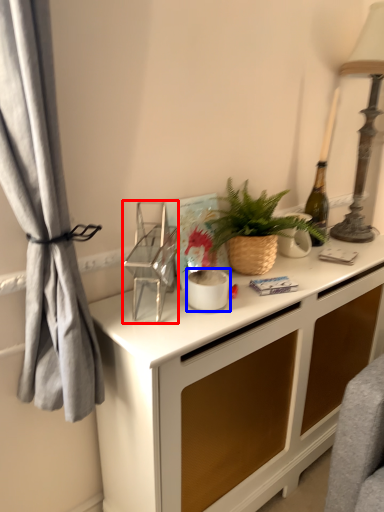
Question: Among these objects, which one is farthest to the camera, appliance (highlighted by a red box) or appliance (highlighted by a blue box)?

Choices:
 (A) appliance
 (B) appliance

Answer: (B)